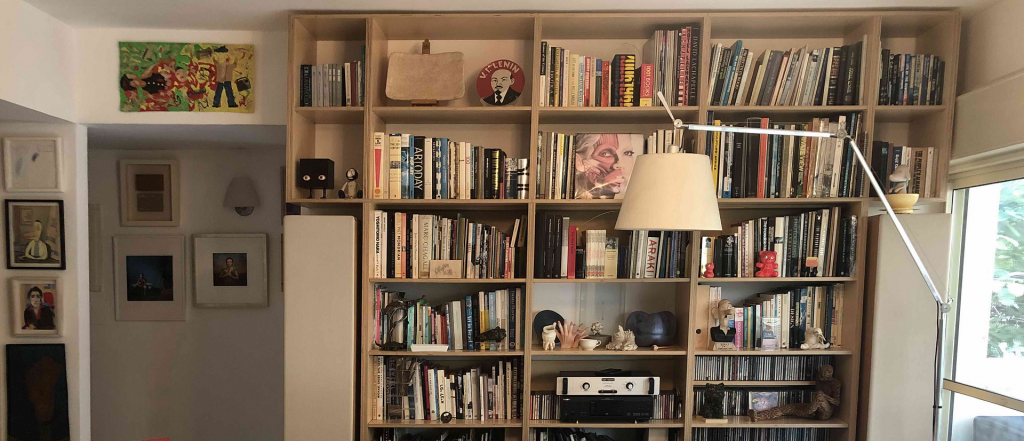
Find the location of `clear hallway wall`. clear hallway wall is located at coordinates (179, 369).